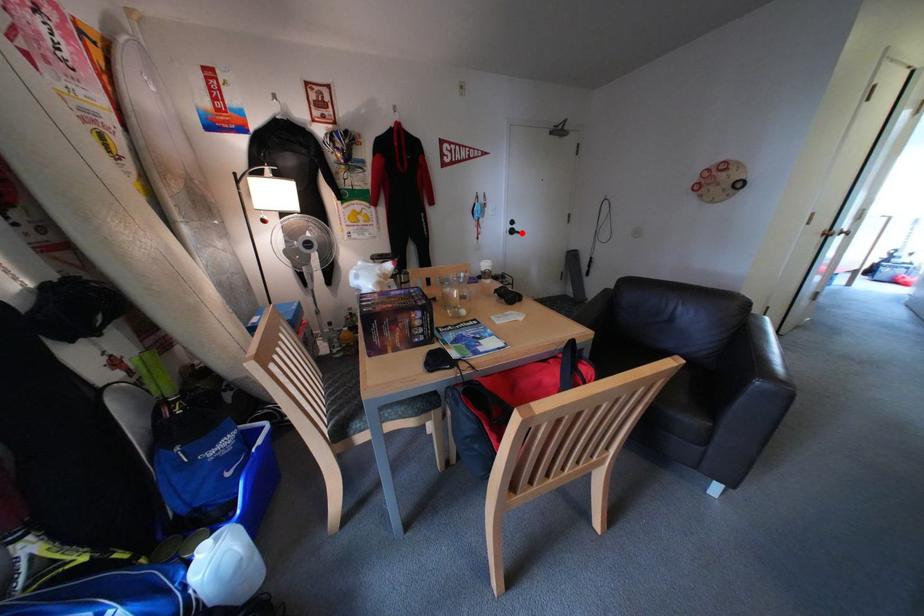
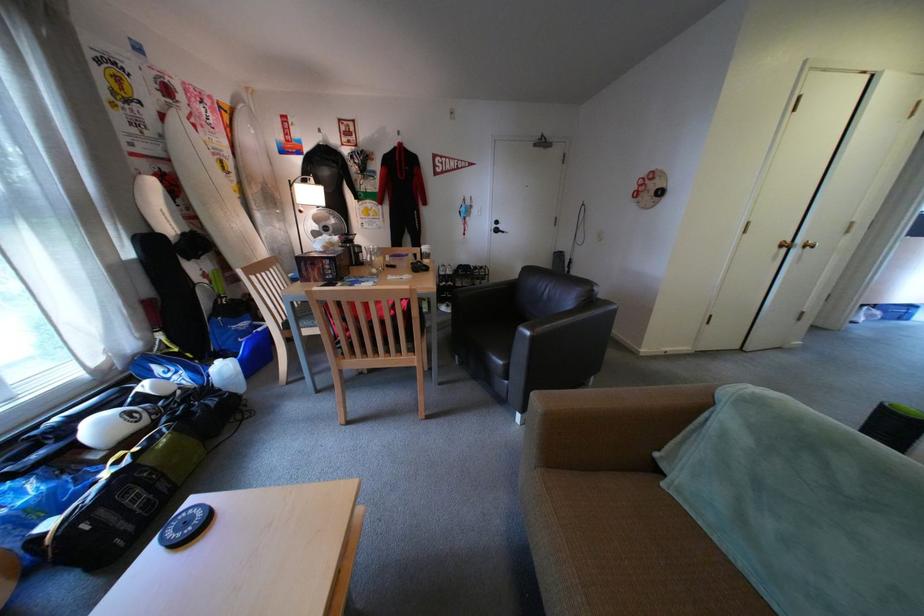
In the second image, find the point that corresponds to the highlighted location in the first image.

(506, 232)